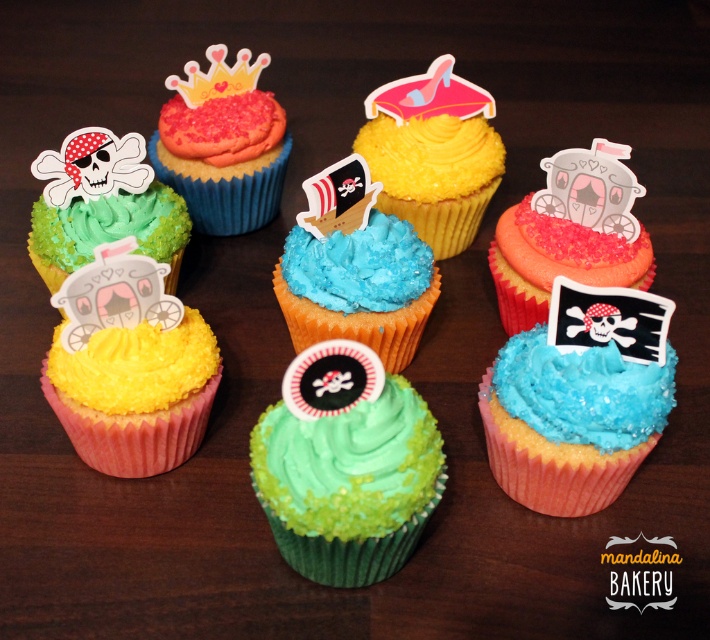
You are a customer at a bakery and want to locate the green matte pirate cupcake at upper left. According to the coordinates provided, where exactly is it positioned on the image?

The green matte pirate cupcake at upper left is positioned at point coordinates of 0.322 along the x axis and 0.146 along the y axis.

You are a photographer standing 4 feet away from the dark wooden surface. You want to take a closeup shot of the matte pink cupcake with carriage at center. Is the cupcake within your reach to focus on?

The matte pink cupcake with carriage at center is 3.98 feet away from the camera. Since you are standing 4 feet away from the dark wooden surface, the cupcake is within your focus range as it is just slightly closer than your standing position.

You are a party planner arranging cupcakes for a themed event. You have a green matte pirate cupcake at upper left and a yellow paper crown at upper center. Which of these two items is bigger in size?

The green matte pirate cupcake at upper left is larger in size compared to the yellow paper crown at upper center according to the description.